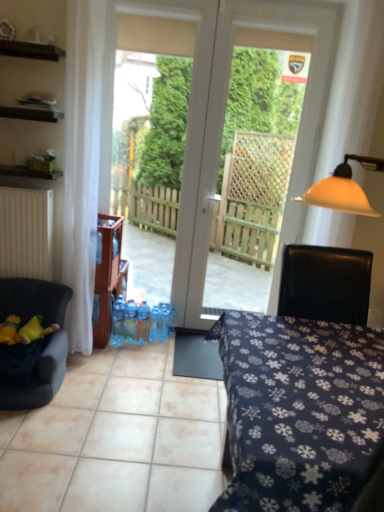
Locate an element on the screen. free space in front of blue plastic bottle at center, the 1th bottle in the right-to-left sequence is located at coordinates (162, 349).